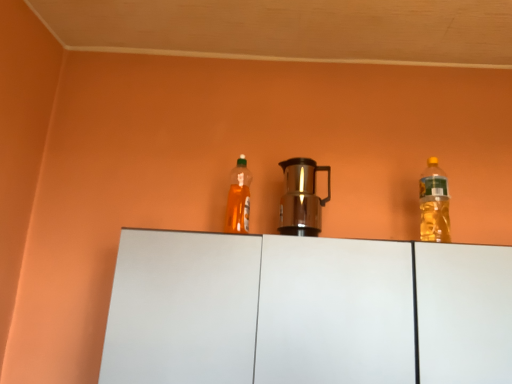
Question: Is translucent yellow bottle at right, the 1th bottle from the right, in front of shiny metallic coffee pot at center?

Choices:
 (A) yes
 (B) no

Answer: (B)

Question: Considering the relative sizes of translucent yellow bottle at right, the 1th bottle from the right, and shiny metallic coffee pot at center in the image provided, is translucent yellow bottle at right, the 1th bottle from the right, shorter than shiny metallic coffee pot at center?

Choices:
 (A) no
 (B) yes

Answer: (A)

Question: Is translucent yellow bottle at right, the 1th bottle from the right, to the right of shiny metallic coffee pot at center from the viewer's perspective?

Choices:
 (A) yes
 (B) no

Answer: (A)

Question: Does translucent yellow bottle at right, the 2th bottle in the left-to-right sequence, have a greater width compared to shiny metallic coffee pot at center?

Choices:
 (A) no
 (B) yes

Answer: (A)

Question: Is translucent yellow bottle at right, the 2th bottle in the left-to-right sequence, to the left of shiny metallic coffee pot at center from the viewer's perspective?

Choices:
 (A) no
 (B) yes

Answer: (A)

Question: Considering the positions of translucent orange bottle at center, which is counted as the 1th bottle, starting from the left, and translucent yellow bottle at right, the 2th bottle in the left-to-right sequence, in the image, is translucent orange bottle at center, which is counted as the 1th bottle, starting from the left, taller or shorter than translucent yellow bottle at right, the 2th bottle in the left-to-right sequence,?

Choices:
 (A) short
 (B) tall

Answer: (A)

Question: In the image, is translucent orange bottle at center, which is counted as the 1th bottle, starting from the left, positioned in front of or behind translucent yellow bottle at right, the 1th bottle from the right?

Choices:
 (A) front
 (B) behind

Answer: (B)

Question: From the image's perspective, is translucent orange bottle at center, which is counted as the 1th bottle, starting from the left, above or below translucent yellow bottle at right, the 1th bottle from the right?

Choices:
 (A) above
 (B) below

Answer: (A)

Question: Is translucent orange bottle at center, placed as the 2th bottle when sorted from right to left, situated inside translucent yellow bottle at right, the 2th bottle in the left-to-right sequence, or outside?

Choices:
 (A) outside
 (B) inside

Answer: (A)

Question: Considering the positions of shiny metallic coffee pot at center and white matte cabinet at center in the image, is shiny metallic coffee pot at center wider or thinner than white matte cabinet at center?

Choices:
 (A) thin
 (B) wide

Answer: (A)

Question: From the image's perspective, is shiny metallic coffee pot at center positioned above or below white matte cabinet at center?

Choices:
 (A) below
 (B) above

Answer: (B)

Question: From a real-world perspective, is shiny metallic coffee pot at center above or below white matte cabinet at center?

Choices:
 (A) above
 (B) below

Answer: (A)

Question: Would you say shiny metallic coffee pot at center is inside or outside white matte cabinet at center?

Choices:
 (A) inside
 (B) outside

Answer: (B)

Question: In the image, is shiny metallic coffee pot at center positioned in front of or behind translucent yellow bottle at right, the 1th bottle from the right?

Choices:
 (A) behind
 (B) front

Answer: (B)

Question: From the image's perspective, relative to translucent yellow bottle at right, the 2th bottle in the left-to-right sequence, is shiny metallic coffee pot at center above or below?

Choices:
 (A) above
 (B) below

Answer: (A)